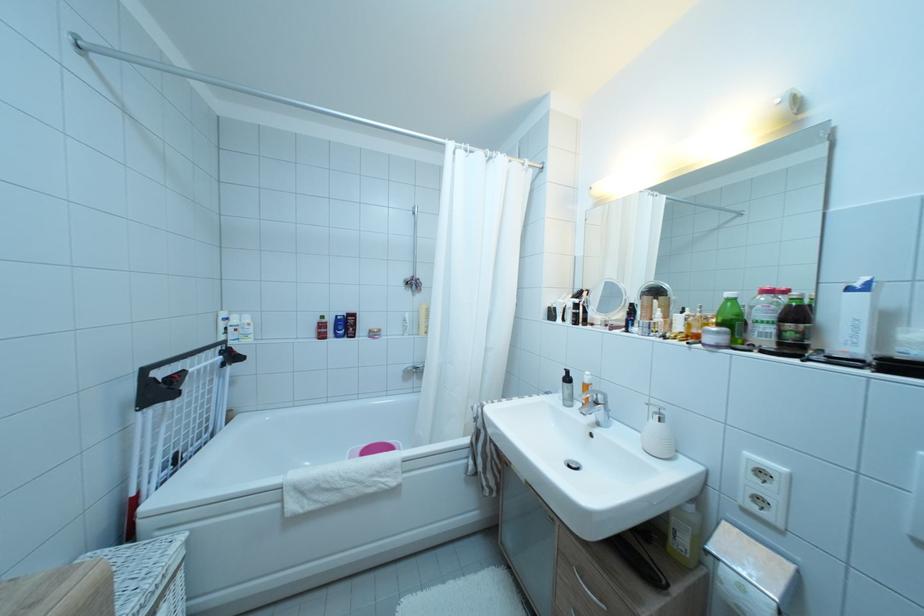
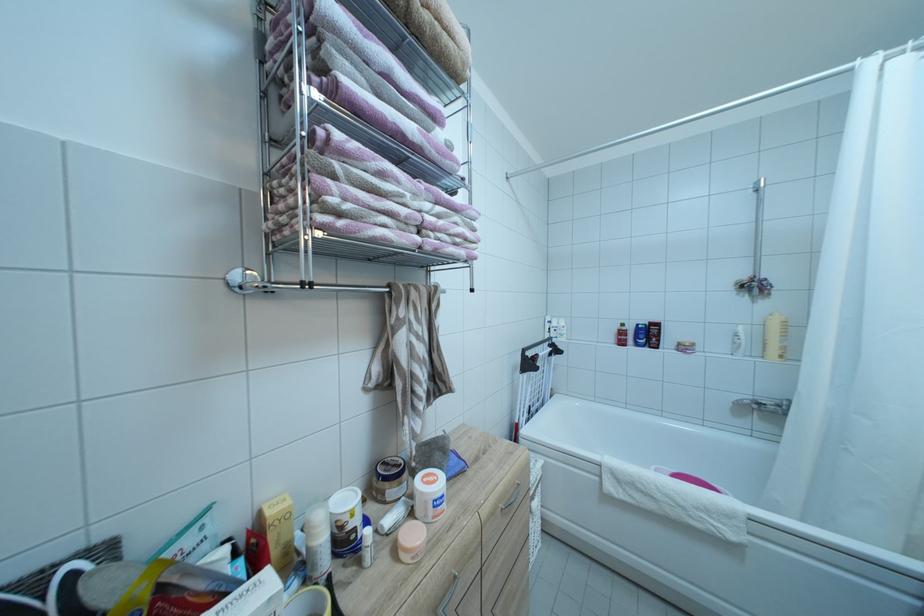
Find the pixel in the second image that matches [343,334] in the first image.

(642, 342)